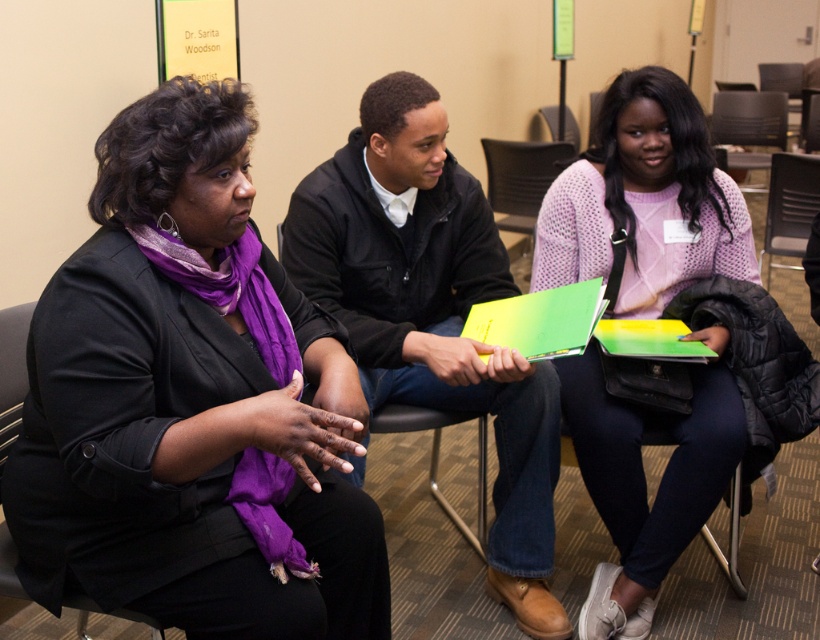
You are standing in the conference room and want to sit down. There is a gray plastic chair at center. Is it close enough for you to sit without walking further than 3 meters?

The gray plastic chair at center is 3.09 meters away from viewer, which is slightly beyond 3 meters, so you would need to walk a bit further to reach it.

You are a photographer standing in the conference room. You want to take a closeup photo of the purple scarf at center. The camera you have can focus as close as 3 feet. Can you get a clear closeup without moving closer than 3.66 feet?

The purple scarf at center is 3.66 feet away from the camera. Since the camera can focus as close as 3 feet, you need to be at least 3 feet away to focus. Since 3.66 feet is further than 3 feet, the camera can focus on the purple scarf at center from that distance, so yes, you can get a clear closeup without moving closer than 3.66 feet.

You are organizing a small event and need to place a 4.5 feet long table between the pink knitted sweater at center and the black fabric chair at left. Will there be enough space?

The distance between the pink knitted sweater at center and the black fabric chair at left is 4.81 feet. Since the table is 4.5 feet long, there is enough space to place it between them as 4.5 is less than 4.81.